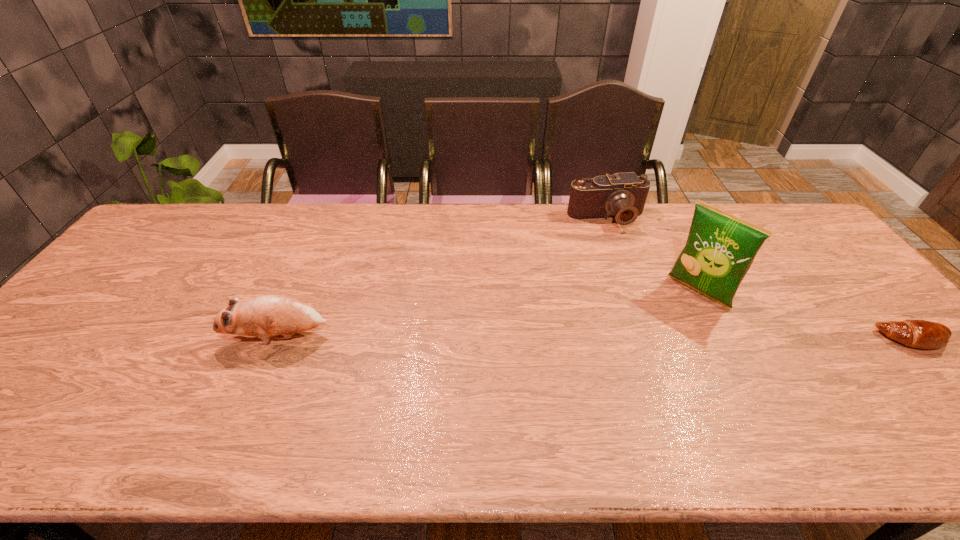
Find the location of a particular element. This screenshot has width=960, height=540. hamster is located at coordinates (273, 314).

At what (x,y) coordinates should I click in order to perform the action: click on the tallest object. Please return your answer as a coordinate pair (x, y). Looking at the image, I should click on (720, 248).

Identify the location of crisp (potato chip). (720, 248).

Find the location of `camera`. camera is located at coordinates (622, 196).

In order to click on free space located at the face of the leftmost object in this screenshot , I will do `click(203, 336)`.

At what (x,y) coordinates should I click in order to perform the action: click on free space located at the face of the leftmost object. Please return your answer as a coordinate pair (x, y). Looking at the image, I should click on (84, 336).

Where is `free space located at the face of the leftmost object`? free space located at the face of the leftmost object is located at coordinates (115, 336).

You are a GUI agent. You are given a task and a screenshot of the screen. Output one action in this format:
    pyautogui.click(x=<x>, y=<y>)
    Task: Click on the vacant space located 0.330m on the front-facing side of the third nearest object
    
    Given the screenshot: What is the action you would take?
    pyautogui.click(x=615, y=374)

This screenshot has width=960, height=540. What are the coordinates of `free spot located 0.330m on the front-facing side of the third nearest object` in the screenshot? It's located at (615, 374).

This screenshot has height=540, width=960. I want to click on free space located on the front-facing side of the third nearest object, so click(652, 338).